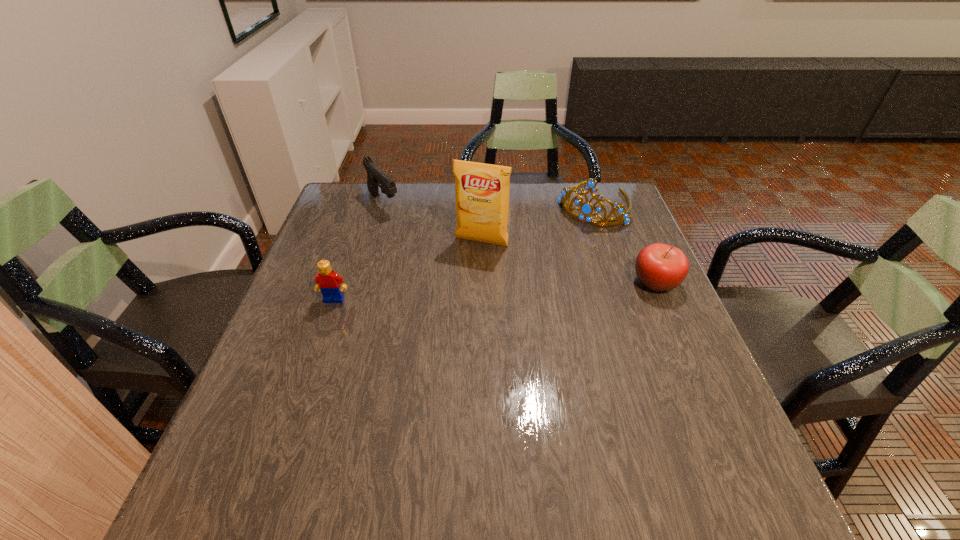
This screenshot has width=960, height=540. Find the location of `free spot on the desktop that is between the Lego and the apple and is positioned on the front of the crisp (potato chip) with the logo`. free spot on the desktop that is between the Lego and the apple and is positioned on the front of the crisp (potato chip) with the logo is located at coordinates (459, 293).

This screenshot has height=540, width=960. In order to click on free space on the desktop that is between the Lego and the apple and is positioned at the barrel of the pistol in this screenshot , I will do `click(472, 293)`.

Find the location of a particular element. The image size is (960, 540). free space on the desktop that is between the Lego and the apple and is positioned on the front-facing side of the tiara is located at coordinates (522, 290).